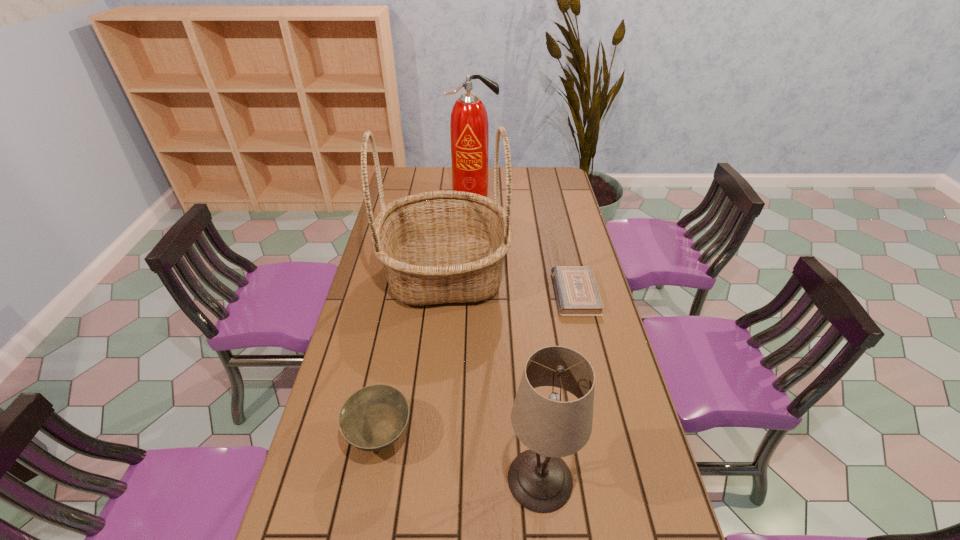
Where is `vacant space located 0.360m on the front-facing side of the third shortest object`? Image resolution: width=960 pixels, height=540 pixels. vacant space located 0.360m on the front-facing side of the third shortest object is located at coordinates coord(355,479).

What are the coordinates of `free space located 0.320m on the right of the bowl` in the screenshot? It's located at (538, 437).

You are a GUI agent. You are given a task and a screenshot of the screen. Output one action in this format:
    pyautogui.click(x=<x>, y=<y>)
    Task: Click on the vacant space located on the spine side of the rightmost object
    The width and height of the screenshot is (960, 540).
    Given the screenshot: What is the action you would take?
    pyautogui.click(x=512, y=293)

Locate an element on the screen. This screenshot has height=540, width=960. vacant region located 0.280m on the spine side of the rightmost object is located at coordinates (474, 293).

You are a GUI agent. You are given a task and a screenshot of the screen. Output one action in this format:
    pyautogui.click(x=<x>, y=<y>)
    Task: Click on the free space located on the spine side of the rightmost object
    
    Given the screenshot: What is the action you would take?
    tap(489, 293)

What are the coordinates of `object that is positioned at the far edge` in the screenshot? It's located at (469, 129).

This screenshot has width=960, height=540. I want to click on basket that is at the left edge, so click(x=436, y=247).

Find the location of `bowl that is at the left edge`. bowl that is at the left edge is located at coordinates (373, 418).

The height and width of the screenshot is (540, 960). Find the location of `object that is at the right edge`. object that is at the right edge is located at coordinates (577, 294).

The width and height of the screenshot is (960, 540). Identify the location of vacant region at the far edge of the desktop. (505, 179).